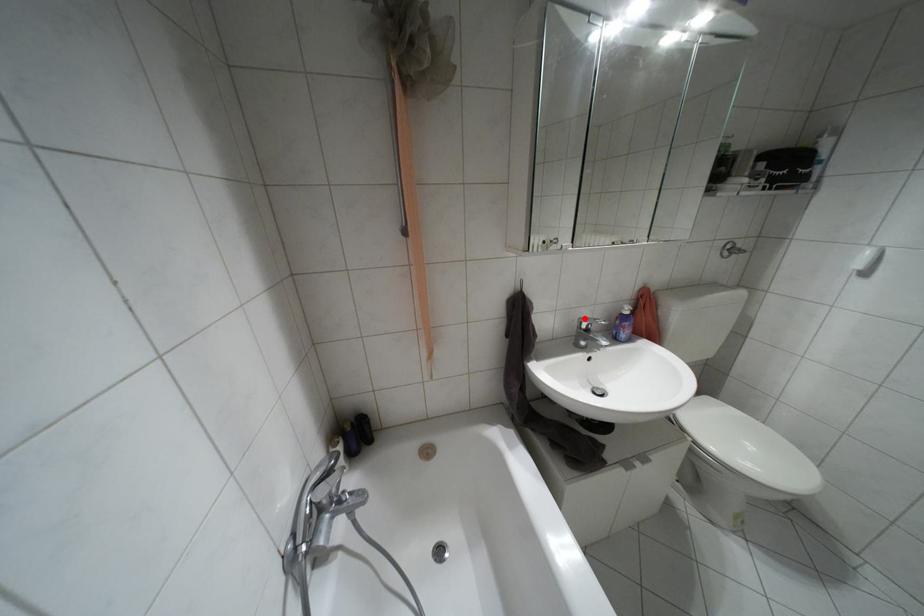
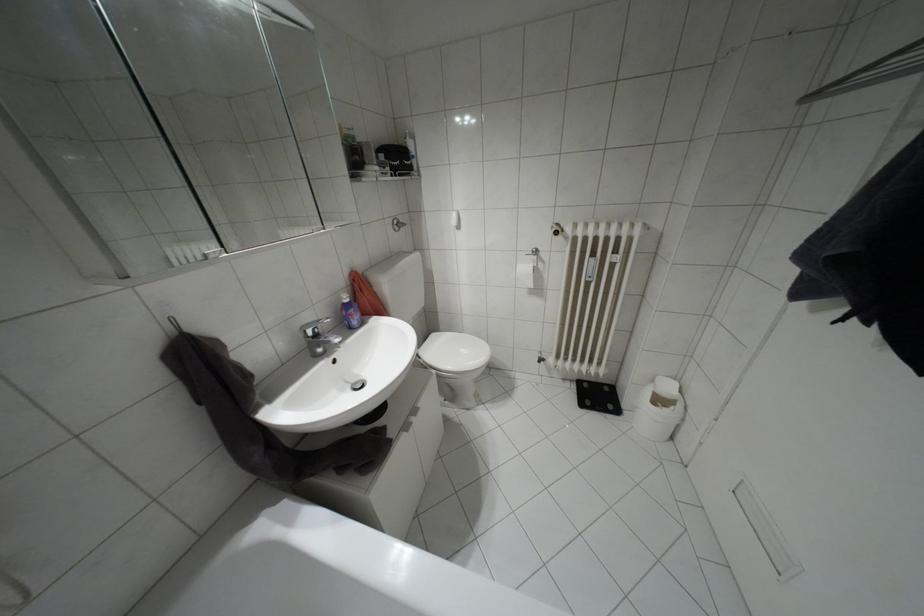
Where in the second image is the point corresponding to the highlighted location from the first image?

(307, 323)